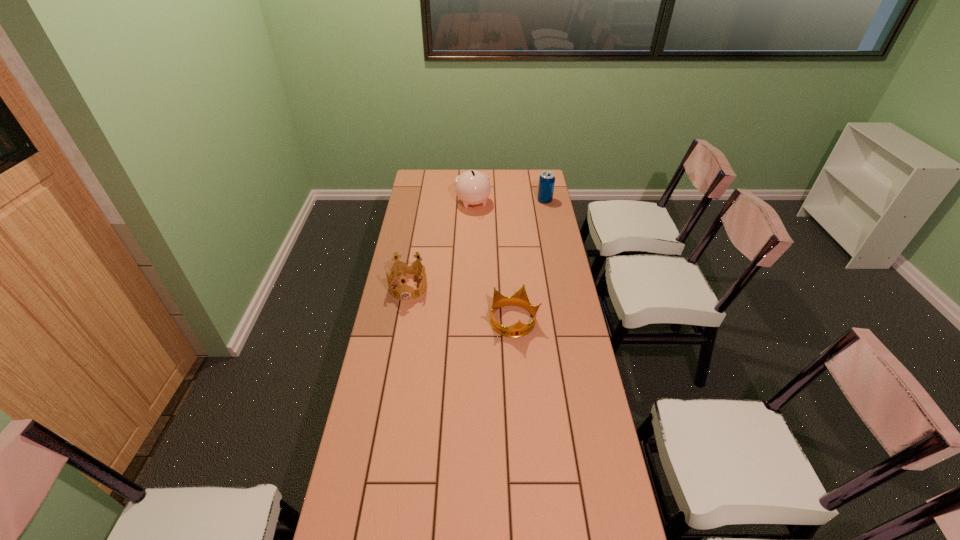
This screenshot has height=540, width=960. I want to click on object that is positioned at the left edge, so click(x=406, y=274).

The image size is (960, 540). Find the location of `pop soda that is at the right edge`. pop soda that is at the right edge is located at coordinates (547, 179).

The width and height of the screenshot is (960, 540). In order to click on crown that is at the right edge in this screenshot , I will do `click(519, 329)`.

Locate an element on the screen. vacant point at the far edge is located at coordinates (503, 187).

Where is `blank area at the left edge`? blank area at the left edge is located at coordinates (388, 342).

Where is `blank space at the right edge of the desktop`? blank space at the right edge of the desktop is located at coordinates (529, 221).

The height and width of the screenshot is (540, 960). I want to click on vacant area at the far left corner, so click(x=414, y=176).

Find the location of a particular element. The image size is (960, 540). vacant point located between the third farthest object and the pop soda is located at coordinates (476, 244).

At what (x,y) coordinates should I click in order to perform the action: click on free space between the shorter crown and the piggy bank. Please return your answer as a coordinate pair (x, y). Looking at the image, I should click on (493, 262).

At what (x,y) coordinates should I click in order to perform the action: click on vacant area that lies between the nearest object and the taller crown. Please return your answer as a coordinate pair (x, y). Image resolution: width=960 pixels, height=540 pixels. Looking at the image, I should click on (461, 305).